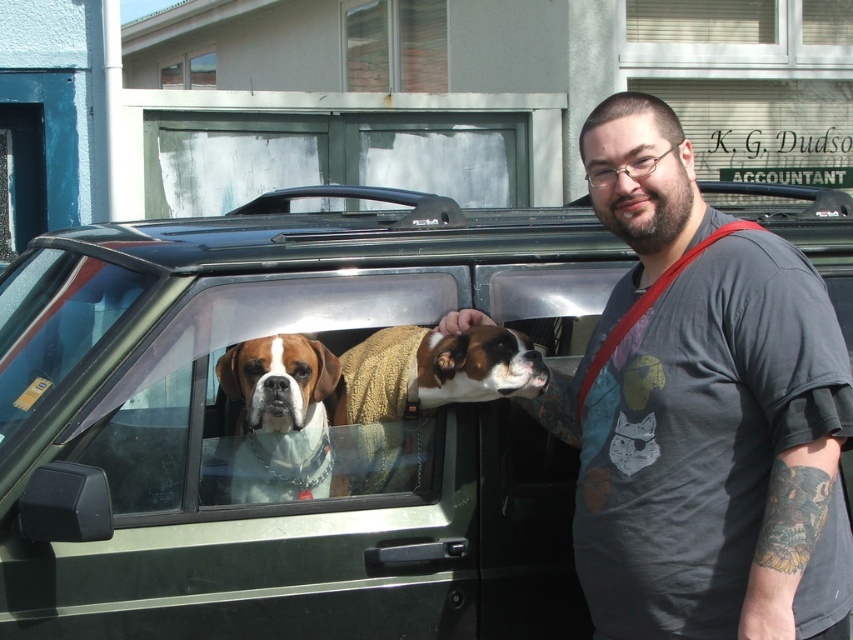
Question: Is dark gray t-shirt at center above clear glass window at center?

Choices:
 (A) yes
 (B) no

Answer: (A)

Question: Which of the following is the closest to the observer?

Choices:
 (A) (135, 468)
 (B) (498, 305)

Answer: (A)

Question: Among these objects, which one is nearest to the camera?

Choices:
 (A) brick wall at upper center
 (B) white and brown fur at center

Answer: (B)

Question: Where is brown and white fur at car window located in relation to clear glass window at upper center in the image?

Choices:
 (A) left
 (B) right

Answer: (B)

Question: Which point appears farthest from the camera in this image?

Choices:
 (A) (199, 77)
 (B) (431, 198)

Answer: (A)

Question: Does brick wall at upper center lie in front of clear glass window at upper center?

Choices:
 (A) no
 (B) yes

Answer: (B)